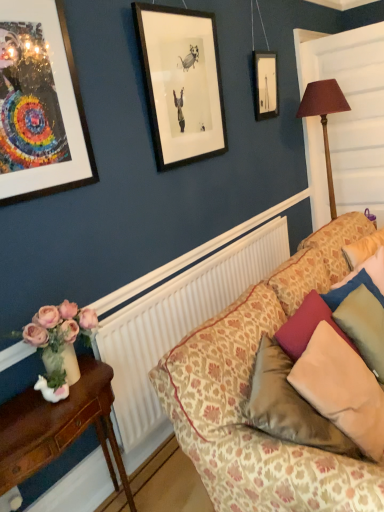
Image resolution: width=384 pixels, height=512 pixels. I want to click on free space above white textured radiator at center (from a real-world perspective), so click(x=208, y=254).